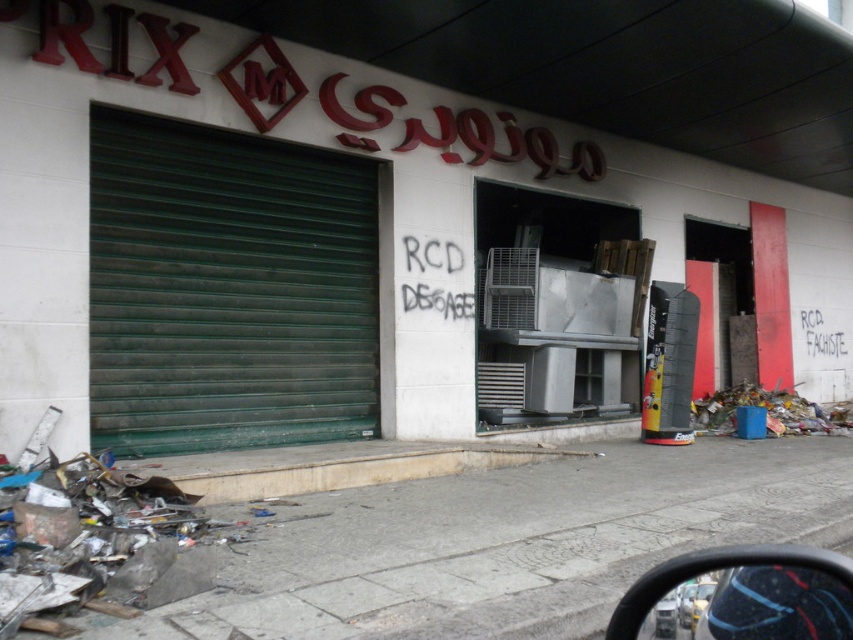
Question: Which point is farther from the camera taking this photo?

Choices:
 (A) (561, 577)
 (B) (454, 400)

Answer: (B)

Question: Among these objects, which one is nearest to the camera?

Choices:
 (A) gray concrete pavement at lower center
 (B) green matte garage door at left
 (C) metallic gray refrigerator at center

Answer: (C)

Question: Can you confirm if green matte garage door at left is positioned to the right of gray concrete pavement at lower center?

Choices:
 (A) no
 (B) yes

Answer: (A)

Question: Is metallic gray refrigerator at center to the left of green matte garage door at left from the viewer's perspective?

Choices:
 (A) yes
 (B) no

Answer: (B)

Question: Can you confirm if green matte garage door at left is positioned to the right of beige concrete curb at lower center?

Choices:
 (A) no
 (B) yes

Answer: (A)

Question: Based on their relative distances, which object is nearer to the metallic gray refrigerator at center?

Choices:
 (A) gray concrete pavement at lower center
 (B) beige concrete curb at lower center

Answer: (B)